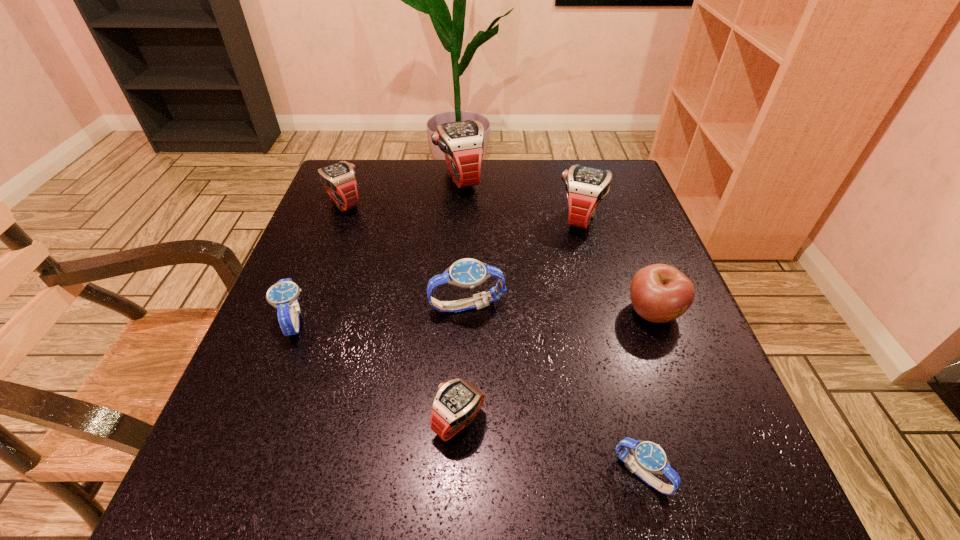
At what (x,y) coordinates should I click in order to perform the action: click on the biggest red watch. Please return your answer as a coordinate pair (x, y). Looking at the image, I should click on (462, 142).

Find the location of a particular element. the tallest watch is located at coordinates (462, 142).

Where is `the rightmost red watch`? This screenshot has width=960, height=540. the rightmost red watch is located at coordinates (586, 187).

At what (x,y) coordinates should I click in order to perform the action: click on the second tallest watch. Please return your answer as a coordinate pair (x, y). The width and height of the screenshot is (960, 540). Looking at the image, I should click on (586, 187).

At what (x,y) coordinates should I click in order to perform the action: click on the leftmost red watch. Please return your answer as a coordinate pair (x, y). The width and height of the screenshot is (960, 540). Looking at the image, I should click on (339, 179).

This screenshot has height=540, width=960. Identify the location of the biggest blue watch. [x=466, y=273].

You are a GUI agent. You are given a task and a screenshot of the screen. Output one action in this format:
    pyautogui.click(x=<x>, y=<y>)
    Task: Click on the apple
    
    Given the screenshot: What is the action you would take?
    pyautogui.click(x=660, y=293)

In order to click on the leftmost blue watch in this screenshot , I will do `click(283, 295)`.

Where is `the nearest red watch`? This screenshot has width=960, height=540. the nearest red watch is located at coordinates (456, 404).

Image resolution: width=960 pixels, height=540 pixels. Identify the location of the second nearest watch. (456, 404).